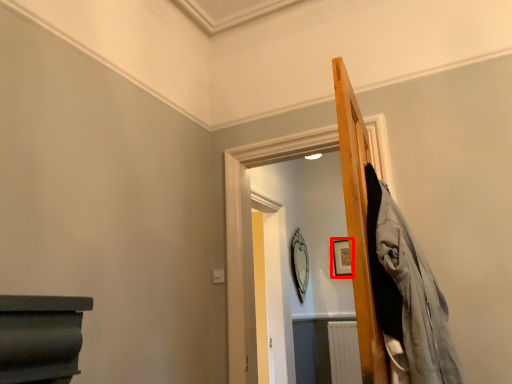
Question: In this image, where is picture frame (annotated by the red box) located relative to mirror?

Choices:
 (A) left
 (B) right

Answer: (B)